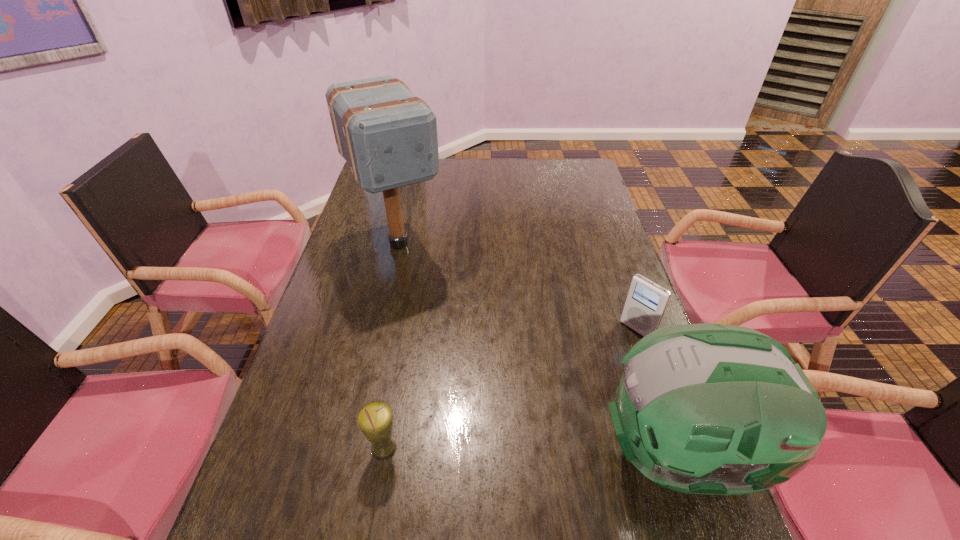
I want to click on straw for drinking, so click(375, 419).

Locate an element on the screen. This screenshot has height=540, width=960. football helmet is located at coordinates [x=715, y=409].

Find the location of a particular element. This screenshot has height=540, width=960. the second farthest object is located at coordinates (646, 302).

At what (x,y) coordinates should I click in order to perform the action: click on iPod. Please return your answer as a coordinate pair (x, y). Looking at the image, I should click on (646, 302).

Locate an element on the screen. This screenshot has height=540, width=960. the farthest object is located at coordinates (388, 136).

Find the location of a particular element. The height and width of the screenshot is (540, 960). mallet is located at coordinates (388, 136).

Locate an element on the screen. The width and height of the screenshot is (960, 540). vacant space located 0.140m on the back of the second shortest object is located at coordinates (396, 379).

This screenshot has height=540, width=960. I want to click on free space located on the front-facing side of the iPod, so click(570, 392).

The width and height of the screenshot is (960, 540). I want to click on free point located 0.370m on the front-facing side of the iPod, so click(x=532, y=426).

I want to click on vacant point located 0.050m on the front-facing side of the iPod, so click(x=617, y=348).